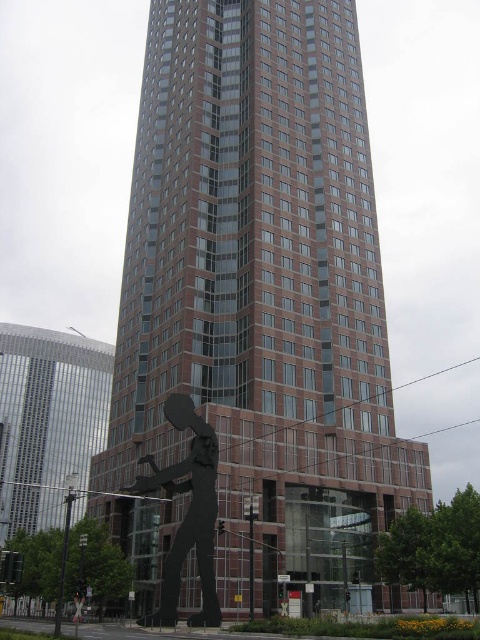
Between brown brick building at center and black matte sculpture at lower center, which one appears on the right side from the viewer's perspective?

From the viewer's perspective, brown brick building at center appears more on the right side.

Is brown brick building at center positioned before black matte sculpture at lower center?

No.

Between point (213, 369) and point (156, 616), which one is positioned behind?

Point (213, 369)

Locate an element on the screen. The image size is (480, 640). brown brick building at center is located at coordinates (263, 296).